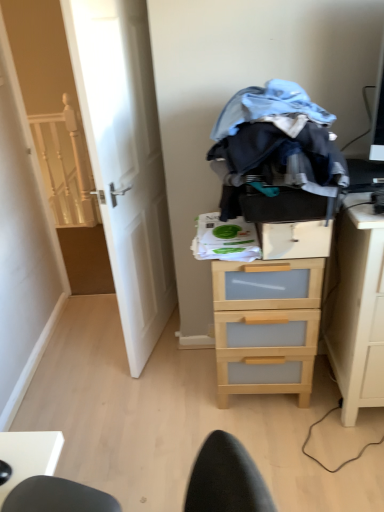
What do you see at coordinates (275, 145) in the screenshot? This screenshot has width=384, height=512. I see `denim fabric clothes at center` at bounding box center [275, 145].

Describe the element at coordinates (295, 240) in the screenshot. I see `wooden drawer at center` at that location.

Describe the element at coordinates (356, 306) in the screenshot. The width and height of the screenshot is (384, 512). I see `light wood/transparent drawer at right` at that location.

At what (x,y) coordinates should I click in order to perform the action: click on light wood/transparent drawer at center. Please return your answer as a coordinate pair (x, y). The width and height of the screenshot is (384, 512). Looking at the image, I should click on (266, 326).

Based on their positions, is wooden drawer at center located to the left or right of light wood/transparent drawer at right?

From the image, it's evident that wooden drawer at center is to the left of light wood/transparent drawer at right.

Can you see wooden drawer at center touching light wood/transparent drawer at right?

wooden drawer at center is not next to light wood/transparent drawer at right, and they're not touching.

Who is bigger, light wood/transparent drawer at right or light wood/transparent drawer at center?

Bigger between the two is light wood/transparent drawer at right.

In terms of height, does light wood/transparent drawer at right look taller or shorter compared to light wood/transparent drawer at center?

In the image, light wood/transparent drawer at right appears to be taller than light wood/transparent drawer at center.

From a real-world perspective, is light wood/transparent drawer at right on top of light wood/transparent drawer at center?

Correct, in the physical world, light wood/transparent drawer at right is higher than light wood/transparent drawer at center.

Identify the location of the chest of drawers directly beneath the light wood/transparent drawer at right (from a real-world perspective). The height and width of the screenshot is (512, 384). (266, 326).

From a real-world perspective, does light wood/transparent drawer at right stand above denim fabric clothes at center?

No.

From the image's perspective, is light wood/transparent drawer at right located above or below denim fabric clothes at center?

light wood/transparent drawer at right is situated lower than denim fabric clothes at center in the image.

Does point (346, 342) come farther from viewer compared to point (333, 182)?

That is True.

In the scene shown: Is denim fabric clothes at center surrounded by light wood/transparent drawer at right?

That's incorrect, denim fabric clothes at center is not inside light wood/transparent drawer at right.

From a real-world perspective, which object stands above the other?

From a 3D spatial view, denim fabric clothes at center is above.

Considering the sizes of white wooden door at left and denim fabric clothes at center in the image, is white wooden door at left wider or thinner than denim fabric clothes at center?

white wooden door at left is thinner than denim fabric clothes at center.

Considering the sizes of objects white wooden door at left and denim fabric clothes at center in the image provided, who is smaller, white wooden door at left or denim fabric clothes at center?

With smaller size is denim fabric clothes at center.

Can denim fabric clothes at center be found inside white wooden door at left?

No, denim fabric clothes at center is not surrounded by white wooden door at left.

Does light wood/transparent drawer at center have a smaller size compared to denim fabric clothes at center?

Actually, light wood/transparent drawer at center might be larger than denim fabric clothes at center.

Is point (256, 383) closer or farther from the camera than point (282, 109)?

Point (256, 383) appears to be farther away from the viewer than point (282, 109).

In the image, is light wood/transparent drawer at center on the left side or the right side of denim fabric clothes at center?

light wood/transparent drawer at center is to the right of denim fabric clothes at center.

In the image, there is a denim fabric clothes at center. Where is `the chest of drawers below it (from a real-world perspective)`? The width and height of the screenshot is (384, 512). the chest of drawers below it (from a real-world perspective) is located at coordinates (266, 326).

Can you see light wood/transparent drawer at center touching white wooden stairwell at left?

No, light wood/transparent drawer at center is not making contact with white wooden stairwell at left.

Is light wood/transparent drawer at center oriented towards white wooden stairwell at left?

No.

Considering the positions of point (239, 325) and point (41, 165), is point (239, 325) closer or farther from the camera than point (41, 165)?

Point (239, 325).

Measure the distance from light wood/transparent drawer at center to light wood/transparent drawer at right.

light wood/transparent drawer at center and light wood/transparent drawer at right are 10.31 inches apart.

Which is behind, light wood/transparent drawer at center or light wood/transparent drawer at right?

light wood/transparent drawer at center is further away from the camera.

Does point (248, 337) appear closer or farther from the camera than point (347, 252)?

Point (248, 337) appears to be farther away from the viewer than point (347, 252).

Is light wood/transparent drawer at center bigger than light wood/transparent drawer at right?

Incorrect, light wood/transparent drawer at center is not larger than light wood/transparent drawer at right.

This screenshot has height=512, width=384. Find the location of `nightstand in front of the wooden drawer at center`. nightstand in front of the wooden drawer at center is located at coordinates pyautogui.click(x=356, y=306).

Where is `nightstand that appears on the right of light wood/transparent drawer at center`? The width and height of the screenshot is (384, 512). nightstand that appears on the right of light wood/transparent drawer at center is located at coordinates (356, 306).

Estimate the real-world distances between objects in this image. Which object is closer to white wooden stairwell at left, white wooden door at left or denim fabric clothes at center?

Based on the image, white wooden door at left appears to be nearer to white wooden stairwell at left.

When comparing their distances from wooden drawer at center, does light wood/transparent drawer at right or light wood/transparent drawer at center seem further?

The object further to wooden drawer at center is light wood/transparent drawer at right.

When comparing their distances from light wood/transparent drawer at right, does denim fabric clothes at center or white wooden stairwell at left seem closer?

Among the two, denim fabric clothes at center is located nearer to light wood/transparent drawer at right.

Looking at the image, which one is located further to white wooden stairwell at left, denim fabric clothes at center or wooden drawer at center?

wooden drawer at center.

Estimate the real-world distances between objects in this image. Which object is further from wooden drawer at center, denim fabric clothes at center or light wood/transparent drawer at center?

light wood/transparent drawer at center is positioned further to the anchor wooden drawer at center.

Based on their spatial positions, is white wooden door at left or light wood/transparent drawer at center closer to wooden drawer at center?

Among the two, light wood/transparent drawer at center is located nearer to wooden drawer at center.

When comparing their distances from denim fabric clothes at center, does light wood/transparent drawer at center or light wood/transparent drawer at right seem closer?

light wood/transparent drawer at right lies closer to denim fabric clothes at center than the other object.

Which object lies further to the anchor point white wooden stairwell at left, white wooden door at left or wooden drawer at center?

The object further to white wooden stairwell at left is wooden drawer at center.

Find the location of a particular element. This screenshot has width=384, height=512. drawer between white wooden door at left and white wooden stairwell at left from front to back is located at coordinates (295, 240).

This screenshot has width=384, height=512. Identify the location of chest of drawers between white wooden door at left and light wood/transparent drawer at right from left to right. (266, 326).

The height and width of the screenshot is (512, 384). What are the coordinates of `the chest of drawers located between white wooden door at left and white wooden stairwell at left in the depth direction` in the screenshot? It's located at (266, 326).

Where is `drawer between white wooden door at left and light wood/transparent drawer at right from left to right`? Image resolution: width=384 pixels, height=512 pixels. drawer between white wooden door at left and light wood/transparent drawer at right from left to right is located at coordinates (295, 240).